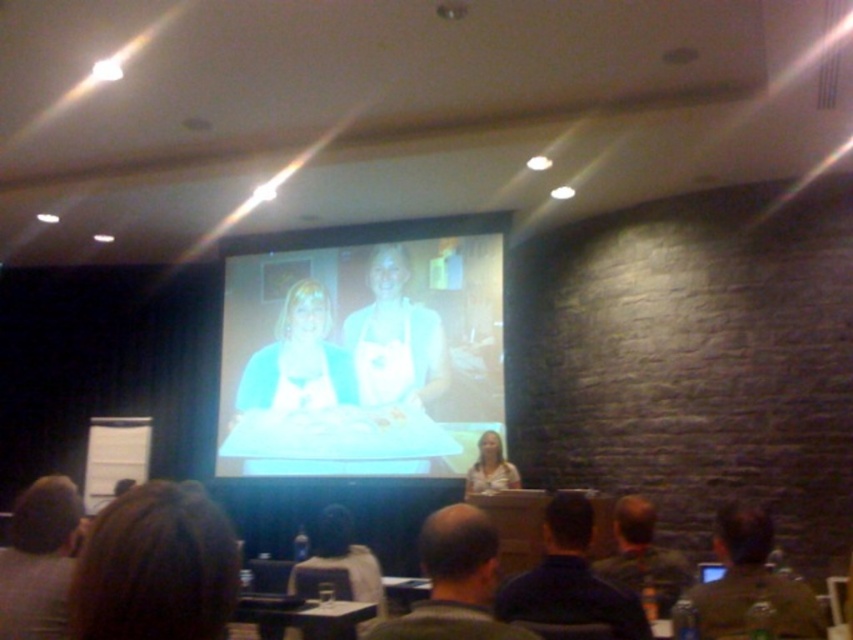
You are a photographer in a presentation setting and need to adjust the lighting to ensure both the bald head at center and the dark blue shirt at lower center are properly illuminated. Which object requires more light adjustment based on their size?

The bald head at center is thinner than the dark blue shirt at lower center, so the bald head at center requires more light adjustment because it is smaller and might not be as evenly lit as the larger dark blue shirt at lower center.

You are an event photographer who needs to capture a clear photo of the bald head at center and the dark blue shirt at lower center during the presentation. Based on their sizes in the image, which one would be harder to focus on?

The bald head at center has a smaller size compared to dark blue shirt at lower center, so it would be harder to focus on the bald head at center because smaller objects can be more challenging to capture clearly in a photograph.

You are an attendee at the presentation. You notice the matte white screen at center and the brown hair at upper left. Which object is positioned higher in the image?

The matte white screen at center is positioned higher than the brown hair at upper left.